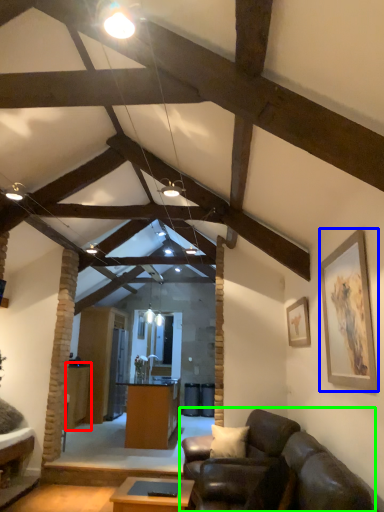
Question: Based on their relative distances, which object is farther from table (highlighted by a red box)? Choose from picture frame (highlighted by a blue box) and studio couch (highlighted by a green box).

Choices:
 (A) picture frame
 (B) studio couch

Answer: (A)